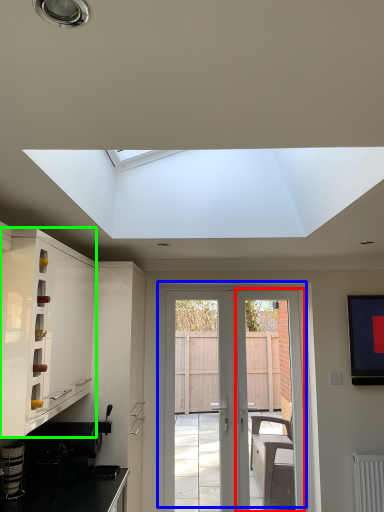
Question: Which object is the closest to the screen door (highlighted by a red box)? Choose among these: door (highlighted by a blue box) or cabinetry (highlighted by a green box).

Choices:
 (A) door
 (B) cabinetry

Answer: (A)